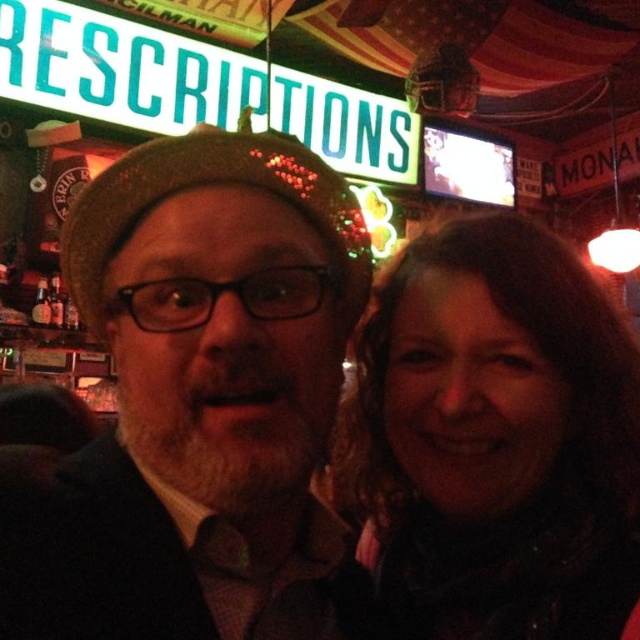
You are a photographer standing in front of the scene. You want to take a photo of the dark brown knit hat at center without including the neon sign in the background. Is the distance between you and the hat sufficient to allow you to zoom in and focus on the hat while keeping the neon sign out of the frame?

The dark brown knit hat at center is 1.93 meters away from camera. Since the hat is positioned at this distance, you can adjust your zoom to focus on it while maintaining enough distance from the neon sign to exclude it from the frame.

You are a photographer standing in the center of the bar. You see the dark brown knit hat at center and the dark brown hair at upper right. Which object is positioned higher in the image?

The dark brown knit hat at center is located above the dark brown hair at upper right, so it is positioned higher in the image.

You are a photographer trying to capture a candid shot of the scene. You want to ensure that both the dark brown knit hat at center and the dark brown hair at upper right are in focus. Based on their positions, which object should you focus on first to ensure both are sharp?

The dark brown knit hat at center is to the left of dark brown hair at upper right. To ensure both are in focus, you should focus on the dark brown knit hat at center first since it is closer to the camera, allowing the depth of field to cover the dark brown hair at upper right as well.